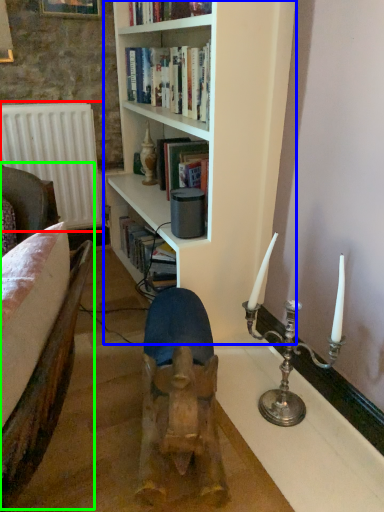
Question: Which object is the farthest from radiator (highlighted by a red box)? Choose among these: bookcase (highlighted by a blue box) or armchair (highlighted by a green box).

Choices:
 (A) bookcase
 (B) armchair

Answer: (B)